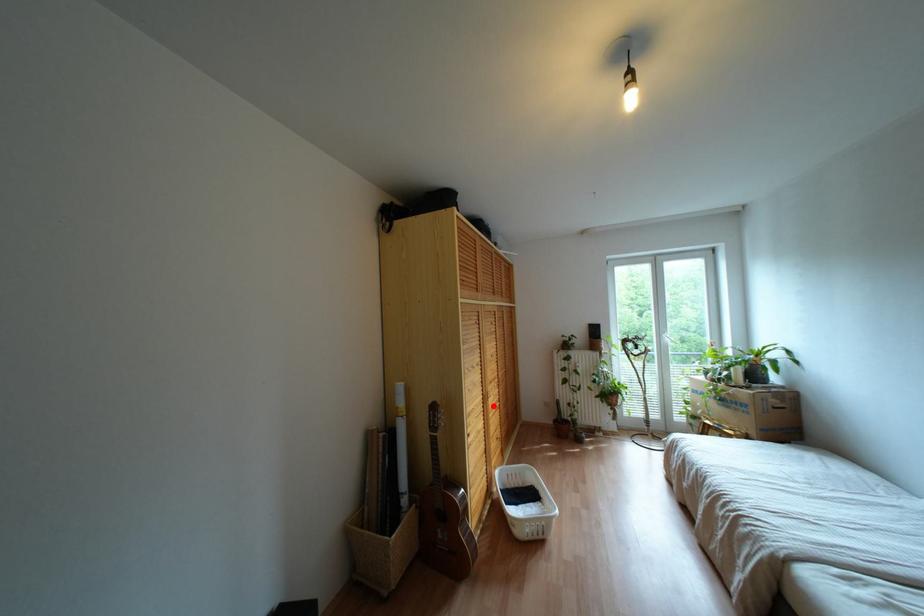
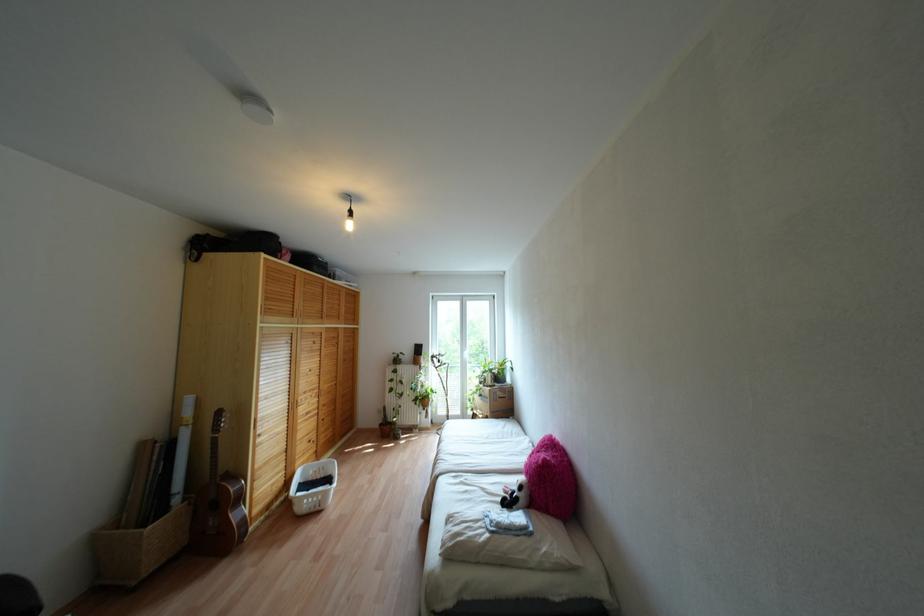
Question: A red point is marked in image1. In image2, is the corresponding 3D point closer to the camera or farther? Reply with the corresponding letter.

Choices:
 (A) The corresponding 3D point is closer.
 (B) The corresponding 3D point is farther.

Answer: (A)